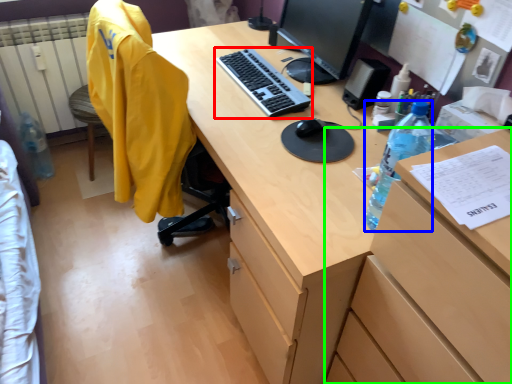
Question: Considering the real-world distances, which object is closest to computer keyboard (highlighted by a red box)? bottle (highlighted by a blue box) or file cabinet (highlighted by a green box).

Choices:
 (A) bottle
 (B) file cabinet

Answer: (A)